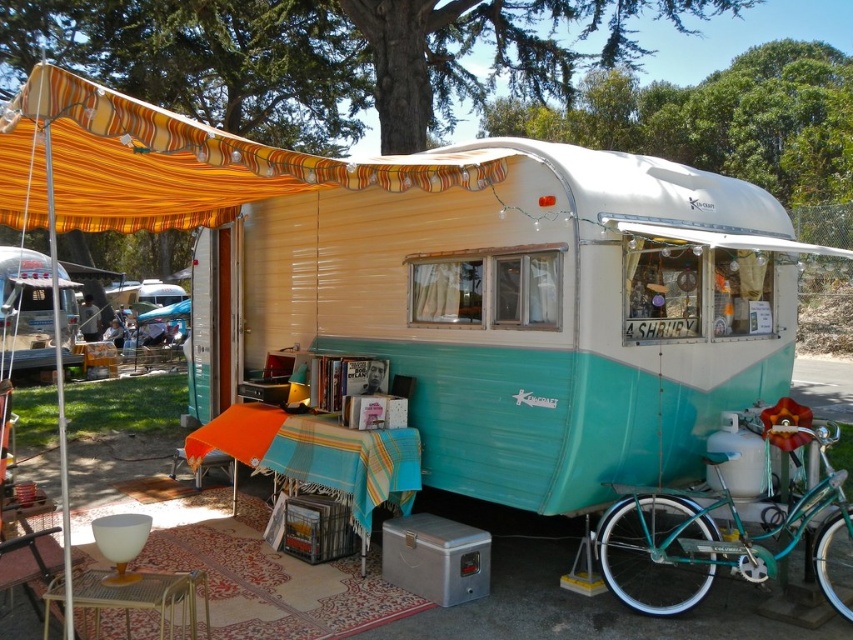
You are planning to set up a small tent that requires 2 meters of space. You see the teal glossy trailer at center and the orange striped fabric canopy at upper left. Which object can you place your tent next to without exceeding the space requirement?

The orange striped fabric canopy at upper left can accommodate the tent since the teal glossy trailer at center is bigger and may not leave enough space.

From the picture: You are planning to set up a picnic area under the orange striped fabric canopy at upper left and need to bring the teal metallic bicycle at lower right into the space. Based on their sizes, will the bicycle fit under the canopy without overlapping the edges?

The orange striped fabric canopy at upper left has a larger width than the teal metallic bicycle at lower right, so the bicycle should fit under the canopy without overlapping the edges.

You are planning to park your teal metallic bicycle at lower right next to the teal glossy trailer at center. Considering their heights, which one will you need to position lower to avoid blocking the view of the other?

The teal metallic bicycle at lower right is shorter than the teal glossy trailer at center, so you should position the teal metallic bicycle at lower right lower to avoid blocking the view of the teal glossy trailer at center.